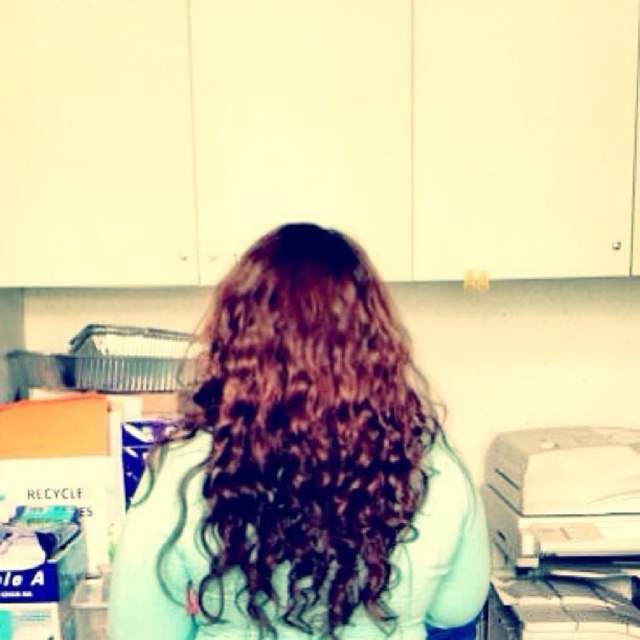
You are a delivery person who needs to place a small package on the countertop near the white matte printer at lower right without blocking the dark brown curly hair at center. Is there enough space?

The dark brown curly hair at center is much taller than the white matte printer at lower right, so placing the package near the printer might block the view of the hair. However, since the hair is at the center and the printer is at the lower right, there should be sufficient space on the countertop near the printer to place the package without obstruction.

You are a photographer adjusting your camera settings to capture the best shot of the scene. You notice two points in the image at coordinates point (134, 545) and point (616, 541). Which point should you focus on to ensure it appears clearer in the photo?

You should focus on point (134, 545) because it is closer to the camera than point (616, 541), so it will appear clearer in the photo.